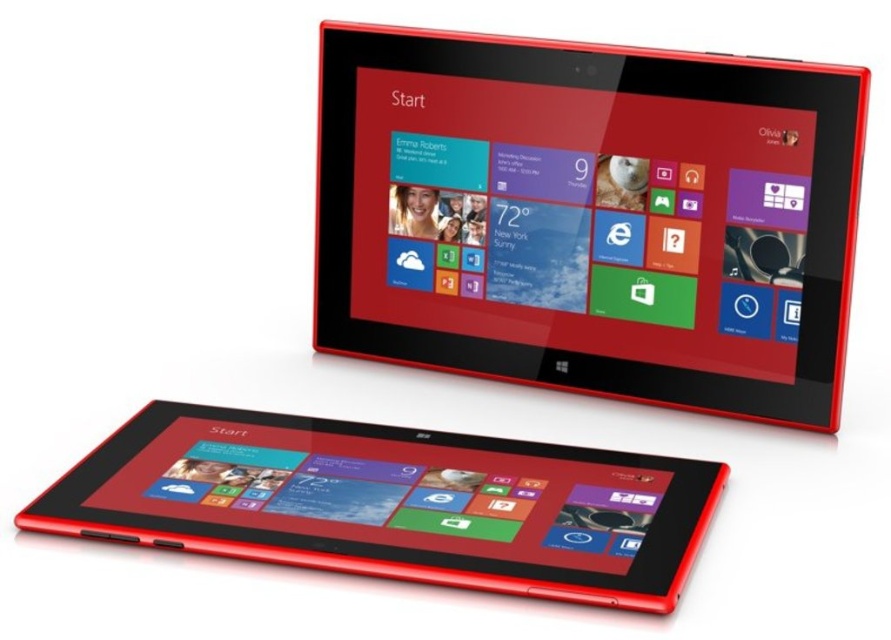
Based on the photo, you have two tablets, a matte plastic tablet at upper center and a matte black tablet at lower left. You want to place them side by side on a shelf that is 18 inches wide. Will they fit without overlapping?

The distance between the matte plastic tablet at upper center and the matte black tablet at lower left is 8.71 inches, so placing them side by side on an 18 inch shelf would leave plenty of space. They will fit without overlapping.

You are holding a matte black tablet at lower left and want to place it next to the matte plastic tablet at upper center. Which direction should you move it?

The matte plastic tablet at upper center is to the right of the matte black tablet at lower left, so you should move the matte black tablet at lower left to the right to place it next to the matte plastic tablet at upper center.

You are trying to locate the matte plastic tablet at upper center in the image. What are its coordinates?

The matte plastic tablet at upper center is located at coordinates point [595,214].